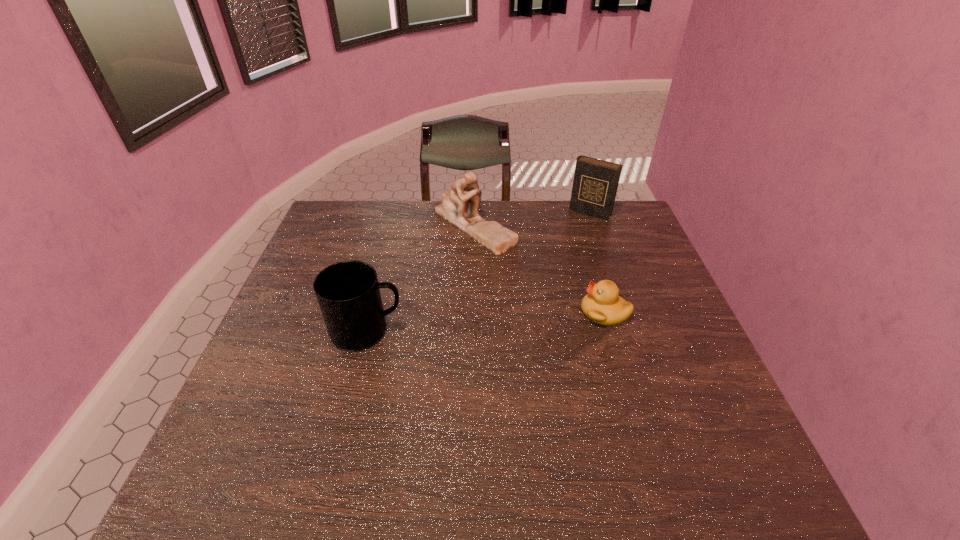
Where is `unoccupied area between the leftmost object and the diary`? The height and width of the screenshot is (540, 960). unoccupied area between the leftmost object and the diary is located at coordinates (479, 272).

Where is `blank region between the diary and the second object from left to right`? blank region between the diary and the second object from left to right is located at coordinates (532, 219).

Identify the location of free spot between the shortest object and the diary. (597, 262).

This screenshot has width=960, height=540. What are the coordinates of `empty space that is in between the shortest object and the mug` in the screenshot? It's located at (486, 321).

Locate an element on the screen. This screenshot has width=960, height=540. free spot between the figurine and the mug is located at coordinates (420, 278).

Locate an element on the screen. The height and width of the screenshot is (540, 960). empty space that is in between the leftmost object and the figurine is located at coordinates (420, 278).

This screenshot has width=960, height=540. Find the location of `the third closest object to the mug`. the third closest object to the mug is located at coordinates (595, 184).

Identify which object is the second closest to the duckling. Please provide its 2D coordinates. Your answer should be formatted as a tuple, i.e. [(x, y)], where the tuple contains the x and y coordinates of a point satisfying the conditions above.

[(595, 184)]

Identify the location of vacant space that satisfies the following two spatial constraints: 1. on the front side of the shortest object; 2. on the front-facing side of the second object from left to right. (472, 312).

Where is `blank area in the image that satisfies the following two spatial constraints: 1. on the front side of the shortest object; 2. on the front-facing side of the third object from right to left`? blank area in the image that satisfies the following two spatial constraints: 1. on the front side of the shortest object; 2. on the front-facing side of the third object from right to left is located at coordinates tap(472, 312).